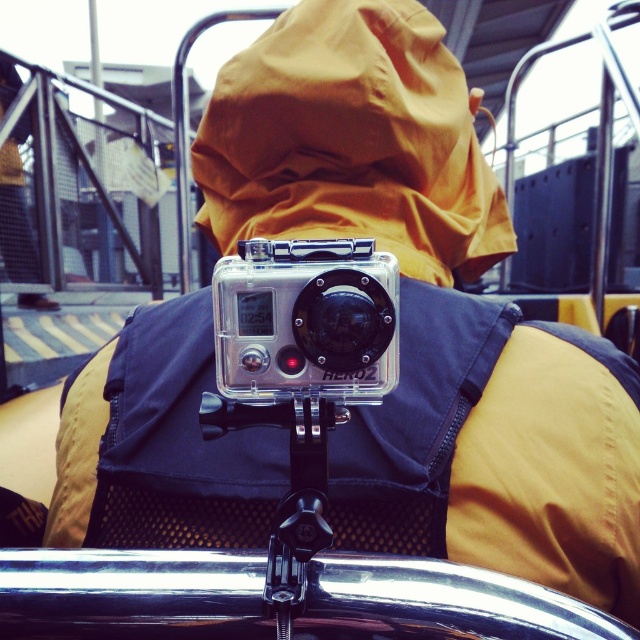
You are trying to determine the distance between two points in the image. The first point is at coordinates point (x=292, y=291) and the second is at point (x=300, y=452). Based on the scene, which point is nearer to the camera?

Point (x=292, y=291) is closer to the camera than point (x=300, y=452).

You are a photographer trying to decide which equipment to pack for a trip. You have the clear plastic camera at center and the black plastic tripod at center. Based on the scene, which item takes up more space in your bag?

The clear plastic camera at center is larger in size than the black plastic tripod at center, so it takes up more space in your bag.

You are a photographer who wants to place both the clear plastic camera at center and the black plastic tripod at center on a small shelf. The shelf can only hold items up to the height of the tripod. Will both items fit on the shelf?

The clear plastic camera at center is taller than the black plastic tripod at center. Since the shelf can only hold items up to the height of the tripod, the camera will not fit on the shelf.